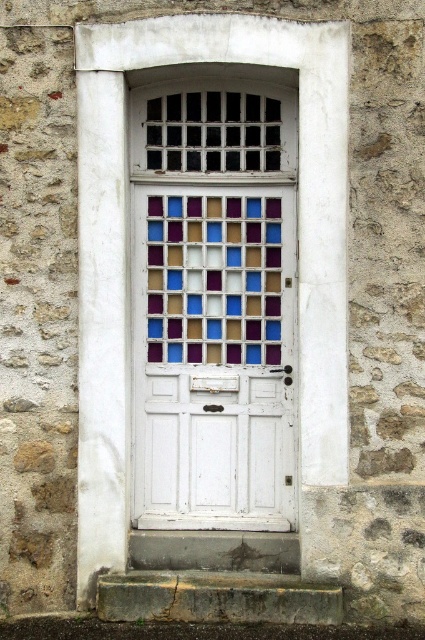
Which is behind, point (170, 36) or point (221, 304)?

The point (221, 304) is behind.

Who is shorter, white painted wood at center or stained glass window at center?

With less height is stained glass window at center.

What do you see at coordinates (127, 250) in the screenshot?
I see `white painted wood at center` at bounding box center [127, 250].

At what (x,y) coordinates should I click in order to perform the action: click on white painted wood at center. Please return your answer as a coordinate pair (x, y). Looking at the image, I should click on (127, 250).

Is white painted wood at center wider than white painted wood door at center?

Yes.

Which is behind, point (76, 589) or point (187, 380)?

Positioned behind is point (187, 380).

What are the coordinates of `white painted wood at center` in the screenshot? It's located at (127, 250).

How much distance is there between white painted wood door at center and stained glass window at center?

The distance of white painted wood door at center from stained glass window at center is 3.71 inches.

Which is more to the right, white painted wood door at center or stained glass window at center?

stained glass window at center

Is point (221, 493) closer to viewer compared to point (254, 340)?

No, (221, 493) is further to viewer.

Locate an element on the screen. This screenshot has height=640, width=425. white painted wood door at center is located at coordinates (212, 356).